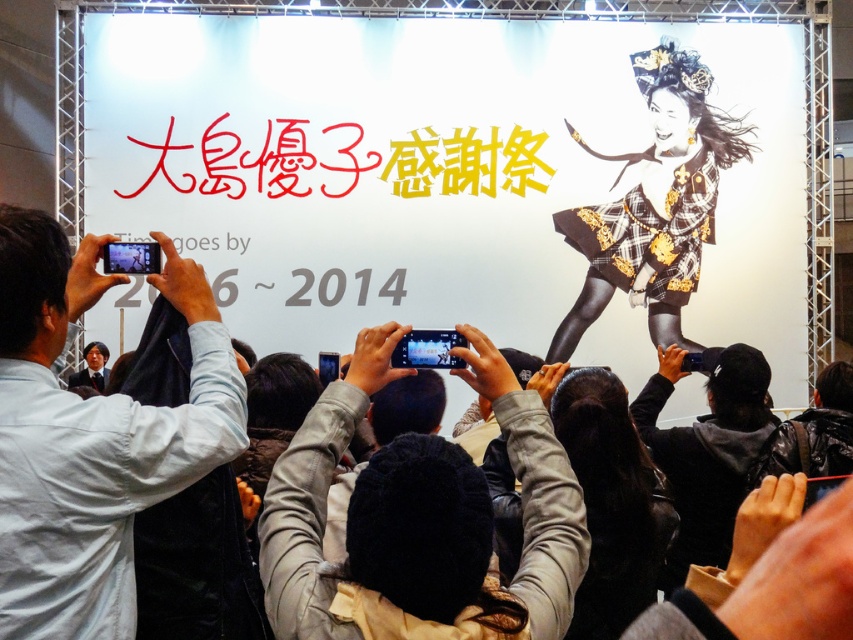
You are a photographer at the event and need to capture a shot that includes both the leather jacket at center and the black leather jacket at lower right. Which jacket should you position on the left side of your frame to ensure both are visible?

The leather jacket at center is positioned on the left side of the black leather jacket at lower right, so to include both in the frame, position the leather jacket at center on the left side of your frame.

You are a photographer at the event and want to ensure both the matte black dress at upper right and the white shirt at left are visible in your shot. Given their sizes, which one might you need to adjust your camera angle to include fully?

The matte black dress at upper right is taller than the white shirt at left, so you might need to adjust your camera angle to accommodate its height to ensure it fits fully in the frame.

From the picture: You are standing in the crowd at the Yuko Oshima Appreciation Festival. You notice two points marked in the scene. The first point is at coordinates approximately (436, 452), and the second is at (685, 499). If you were to walk directly toward the banner, which point would you reach first?

Point at coordinates (436, 452) is closer to the viewer than point at (685, 499), so you would reach the point at (436, 452) first when moving toward the banner.